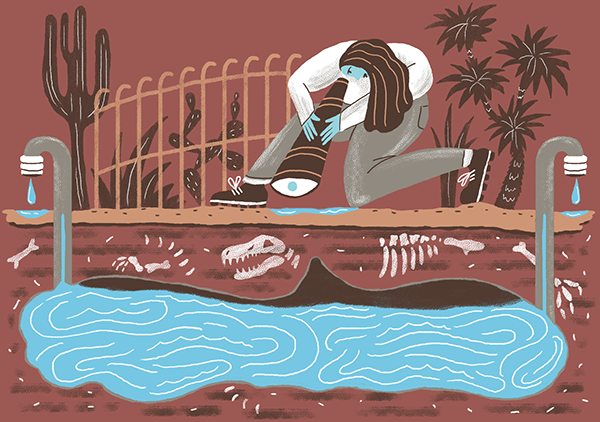
The width and height of the screenshot is (600, 422). I want to click on taps, so click(x=553, y=177), click(x=61, y=177).